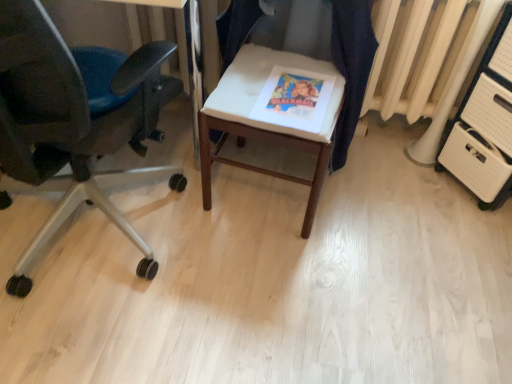
Question: Can you confirm if white fabric chair at center is thinner than white plastic file cabinet at right?

Choices:
 (A) no
 (B) yes

Answer: (A)

Question: Can you confirm if white fabric chair at center is positioned to the left of white plastic file cabinet at right?

Choices:
 (A) no
 (B) yes

Answer: (B)

Question: From a real-world perspective, is white fabric chair at center on top of white plastic file cabinet at right?

Choices:
 (A) no
 (B) yes

Answer: (B)

Question: Is white fabric chair at center closer to camera compared to white plastic file cabinet at right?

Choices:
 (A) yes
 (B) no

Answer: (A)

Question: From the image's perspective, does white fabric chair at center appear lower than white plastic file cabinet at right?

Choices:
 (A) no
 (B) yes

Answer: (B)

Question: Does white fabric chair at center come behind white plastic file cabinet at right?

Choices:
 (A) yes
 (B) no

Answer: (B)

Question: From a real-world perspective, does white plastic file cabinet at right sit lower than matte black office chair at left, marked as the second chair in a right-to-left arrangement?

Choices:
 (A) no
 (B) yes

Answer: (B)

Question: Is white plastic file cabinet at right outside of matte black office chair at left, marked as the second chair in a right-to-left arrangement?

Choices:
 (A) no
 (B) yes

Answer: (B)

Question: Is white plastic file cabinet at right facing towards matte black office chair at left, marked as the second chair in a right-to-left arrangement?

Choices:
 (A) no
 (B) yes

Answer: (B)

Question: Does white plastic file cabinet at right lie behind matte black office chair at left, marked as the second chair in a right-to-left arrangement?

Choices:
 (A) no
 (B) yes

Answer: (B)

Question: Considering the relative positions of white plastic file cabinet at right and matte black office chair at left, the first chair viewed from the left, in the image provided, is white plastic file cabinet at right to the right of matte black office chair at left, the first chair viewed from the left, from the viewer's perspective?

Choices:
 (A) no
 (B) yes

Answer: (B)

Question: Does white plastic file cabinet at right touch matte black office chair at left, the first chair viewed from the left?

Choices:
 (A) no
 (B) yes

Answer: (A)

Question: Is matte paper magazine at center aimed at white fabric cushion at center, which appears as the 2th chair when viewed from the left?

Choices:
 (A) yes
 (B) no

Answer: (B)